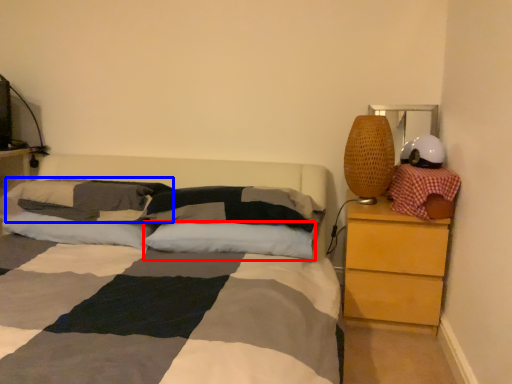
Question: Which point is closer to the camera, pillow (highlighted by a red box) or pillow (highlighted by a blue box)?

Choices:
 (A) pillow
 (B) pillow

Answer: (A)